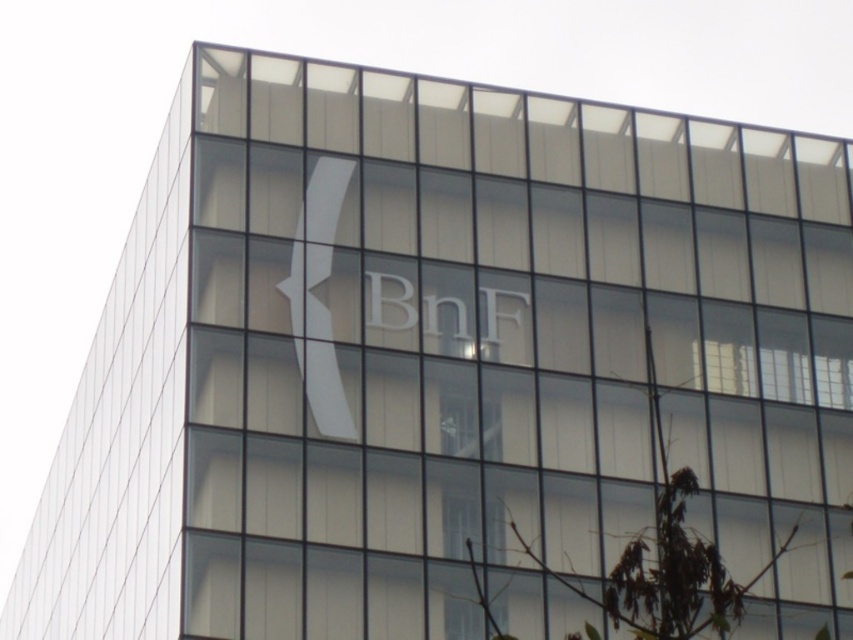
This screenshot has height=640, width=853. What are the coordinates of `white glass logo at center` in the screenshot? It's located at tap(317, 298).

Based on the photo, who is positioned more to the left, white glass logo at center or transparent glass window at center?

white glass logo at center

Describe the element at coordinates (317, 298) in the screenshot. I see `white glass logo at center` at that location.

Locate an element on the screen. white glass logo at center is located at coordinates (317, 298).